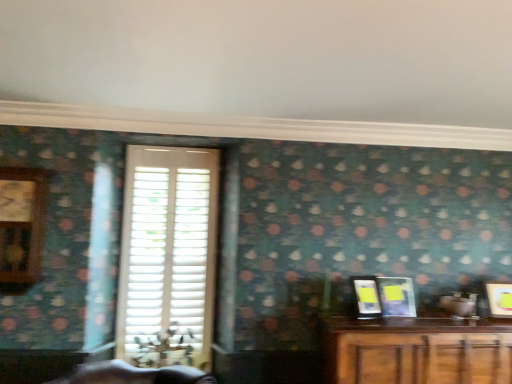
Locate an element on the screen. The height and width of the screenshot is (384, 512). vacant region above wooden clock at left (from a real-world perspective) is located at coordinates (23, 169).